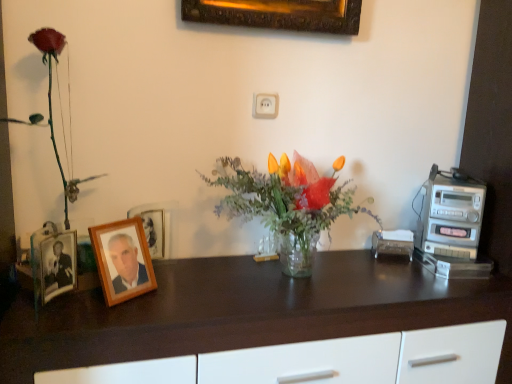
Question: Considering the positions of point (100, 271) and point (155, 226), is point (100, 271) closer or farther from the camera than point (155, 226)?

Choices:
 (A) closer
 (B) farther

Answer: (A)

Question: From the image's perspective, is wooden photo frame at left, the first picture frame when ordered from front to back, above or below wooden picture frame at left, arranged as the first picture frame when viewed from the back?

Choices:
 (A) below
 (B) above

Answer: (A)

Question: Which is nearer to the clear glass vase at center?

Choices:
 (A) wooden picture frame at left, acting as the second picture frame starting from the front
 (B) matte plastic rose at left
 (C) dark wood desk at center
 (D) silver metallic stereo at right
 (E) wooden photo frame at left, the 2th picture frame when ordered from back to front

Answer: (C)

Question: Considering the real-world distances, which object is farthest from the matte plastic rose at left?

Choices:
 (A) dark wood desk at center
 (B) silver metallic stereo at right
 (C) wooden photo frame at left, the first picture frame when ordered from front to back
 (D) wooden picture frame at left, arranged as the first picture frame when viewed from the back
 (E) clear glass vase at center

Answer: (B)